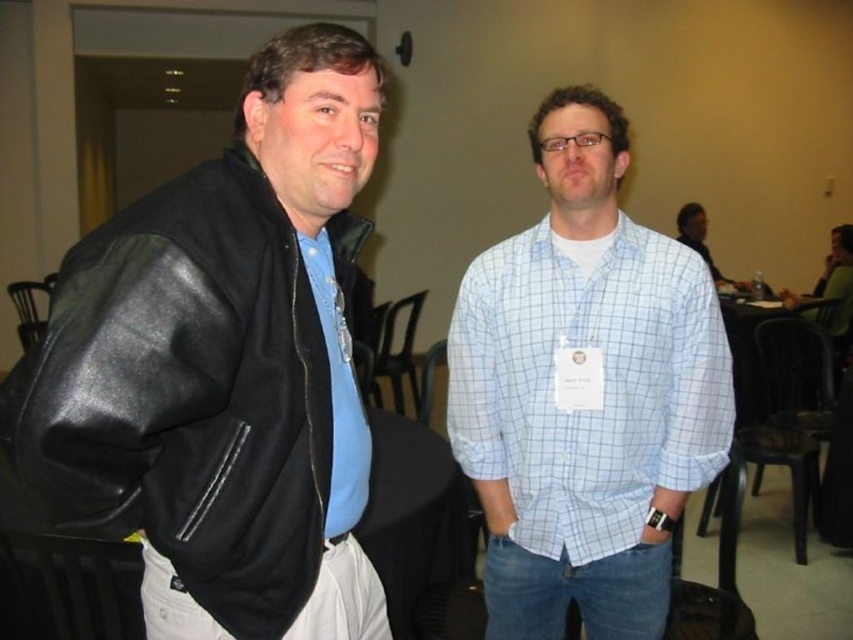
Does black leather jacket at left have a larger size compared to light blue checkered shirt at center?

No.

Who is lower down, black leather jacket at left or light blue checkered shirt at center?

light blue checkered shirt at center is lower down.

Where is `black leather jacket at left`? The width and height of the screenshot is (853, 640). black leather jacket at left is located at coordinates (186, 394).